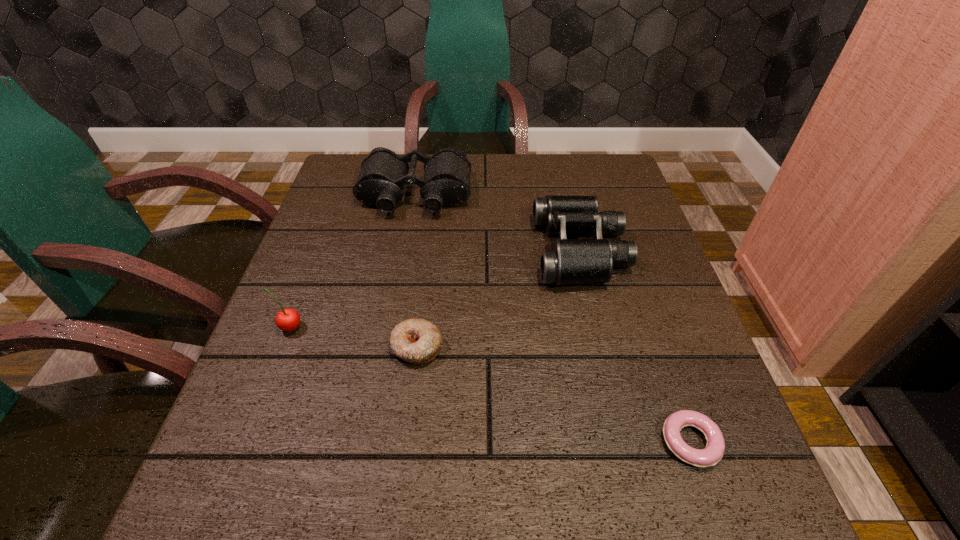
Locate an element on the screen. Image resolution: width=960 pixels, height=540 pixels. free location located through the eyepieces of the left binoculars is located at coordinates coord(409,233).

Image resolution: width=960 pixels, height=540 pixels. In order to click on free space located on the right of the leftmost object in this screenshot , I will do `click(499, 328)`.

What are the coordinates of `free spot located on the left of the farther doughnut` in the screenshot? It's located at (273, 347).

This screenshot has width=960, height=540. In order to click on free region located 0.330m on the back of the nearest object in this screenshot , I will do `click(633, 274)`.

You are a GUI agent. You are given a task and a screenshot of the screen. Output one action in this format:
    pyautogui.click(x=<x>, y=<y>)
    Task: Click on the object that is at the far edge
    This screenshot has height=540, width=960.
    Given the screenshot: What is the action you would take?
    pyautogui.click(x=446, y=182)

Find the location of a particular element. Image resolution: width=960 pixels, height=540 pixels. binoculars present at the left edge is located at coordinates (446, 182).

I want to click on cherry located in the left edge section of the desktop, so pyautogui.click(x=288, y=319).

Where is `binoculars located in the right edge section of the desktop`? The image size is (960, 540). binoculars located in the right edge section of the desktop is located at coordinates (570, 261).

Where is `doughnut at the right edge`? doughnut at the right edge is located at coordinates (713, 452).

Where is `object that is at the far left corner`? object that is at the far left corner is located at coordinates pos(446,182).